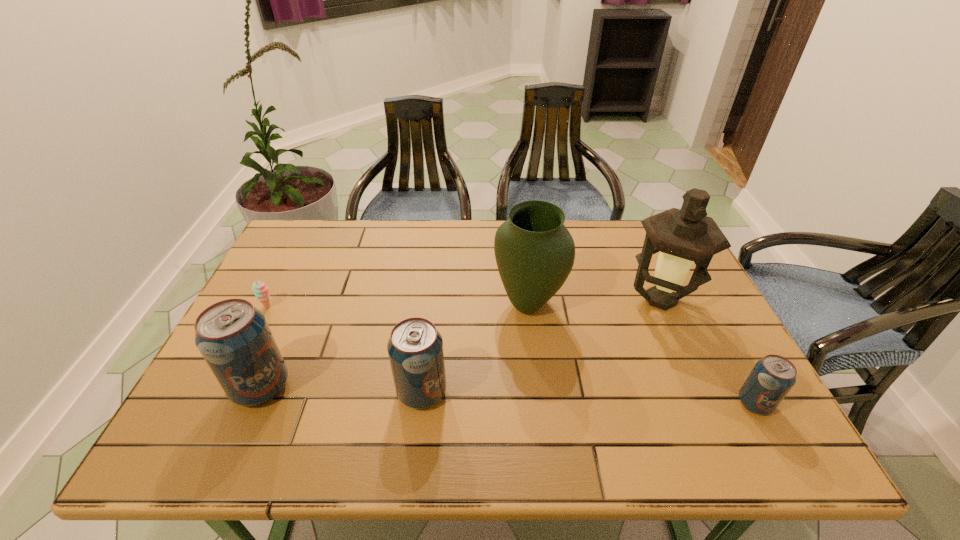
Identify the location of vacant area that lies between the leftmost pop soda and the oil lamp. This screenshot has width=960, height=540. (461, 343).

Find the location of a particular element. This screenshot has height=540, width=960. unoccupied area between the leftmost pop soda and the third shortest object is located at coordinates point(342,389).

Where is `vacant area that lies between the fifth shortest object and the oil lamp`? This screenshot has height=540, width=960. vacant area that lies between the fifth shortest object and the oil lamp is located at coordinates (594, 302).

This screenshot has height=540, width=960. Identify the location of free space between the shortest pop soda and the sherbert. (512, 355).

The image size is (960, 540). In order to click on free space that is in between the oil lamp and the third object from right to left in this screenshot , I will do `click(594, 302)`.

Find the location of `empty space between the vase and the shortest pop soda`. empty space between the vase and the shortest pop soda is located at coordinates (641, 354).

Where is `object identified as the third closest to the leftmost pop soda`? The image size is (960, 540). object identified as the third closest to the leftmost pop soda is located at coordinates (534, 251).

This screenshot has width=960, height=540. What are the coordinates of `the third closest object relative to the oil lamp` in the screenshot? It's located at (415, 348).

Where is `the closest pop soda to the oil lamp`? This screenshot has width=960, height=540. the closest pop soda to the oil lamp is located at coordinates (772, 377).

Point out which pop soda is positioned as the second nearest to the fifth tallest object. Please provide its 2D coordinates. Your answer should be formatted as a tuple, i.e. [(x, y)], where the tuple contains the x and y coordinates of a point satisfying the conditions above.

[(234, 338)]